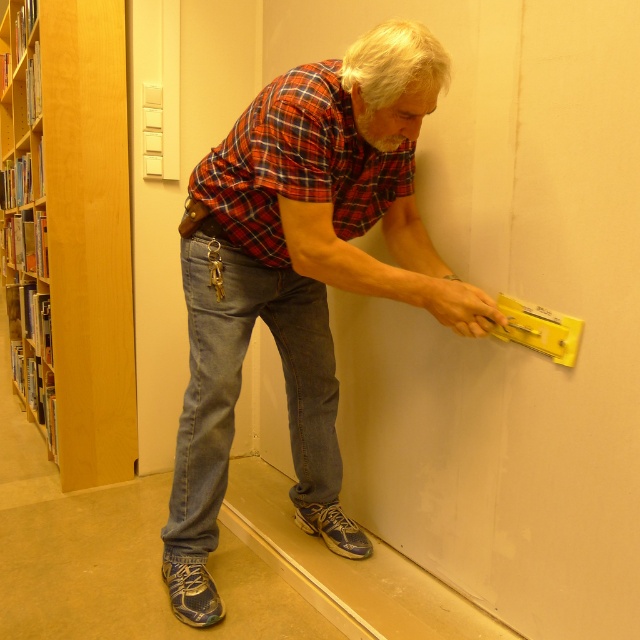
Question: Which point is closer to the camera taking this photo?

Choices:
 (A) (396, 221)
 (B) (81, 337)

Answer: (A)

Question: Where is matte plaid shirt at center located in relation to red plaid shirt at center in the image?

Choices:
 (A) below
 (B) above

Answer: (A)

Question: Which object appears closest to the camera in this image?

Choices:
 (A) red plaid shirt at center
 (B) matte plaid shirt at center
 (C) wooden bookshelf at left

Answer: (B)

Question: In this image, where is matte plaid shirt at center located relative to wooden bookcase at left?

Choices:
 (A) below
 (B) above

Answer: (A)

Question: Which point appears farthest from the camera in this image?

Choices:
 (A) 266,134
 (B) 45,353
 (C) 13,164
 (D) 291,426

Answer: (C)

Question: Observing the image, what is the correct spatial positioning of wooden bookcase at left in reference to wooden bookshelf at left?

Choices:
 (A) right
 (B) left

Answer: (A)